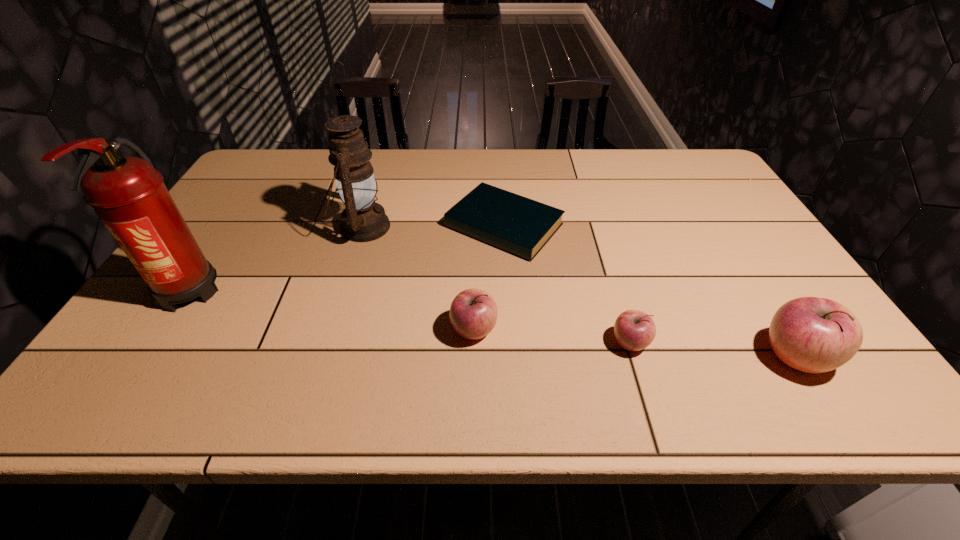
I want to click on the leftmost apple, so click(473, 313).

At what (x,y) coordinates should I click in order to perform the action: click on the second tallest apple. Please return your answer as a coordinate pair (x, y). Image resolution: width=960 pixels, height=540 pixels. Looking at the image, I should click on (473, 313).

What are the coordinates of `the shortest apple` in the screenshot? It's located at (634, 330).

Find the location of `the fifth tallest object`. the fifth tallest object is located at coordinates (634, 330).

In order to click on the tallest apple in this screenshot , I will do `click(814, 335)`.

Where is `the rightmost object`? the rightmost object is located at coordinates (814, 335).

Locate an element on the screen. This screenshot has width=960, height=540. book is located at coordinates (519, 225).

I want to click on fire extinguisher, so click(128, 194).

Find the location of a particular element. The image size is (960, 540). the tallest object is located at coordinates (128, 194).

Find the location of `the fifth shortest object`. the fifth shortest object is located at coordinates (363, 220).